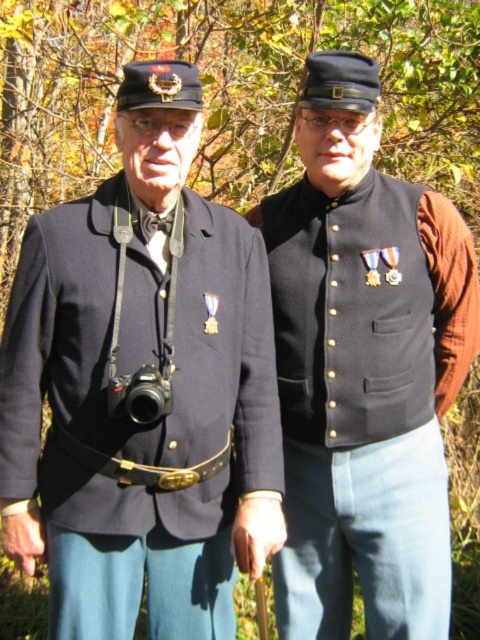
Based on the photo, based on the scene description, can you determine the spatial relationship between the matte black jacket at center and the matte black vest at center?

The matte black jacket at center is to the left of the matte black vest at center.

You are a photographer carrying a 30 cm wide camera case. You want to place it between the matte black jacket at center and the black plastic camera at left. Is there enough space?

The matte black jacket at center and the black plastic camera at left are 31.97 centimeters apart, so yes, the 30 cm wide camera case can fit between them since the space is slightly wider than the case.